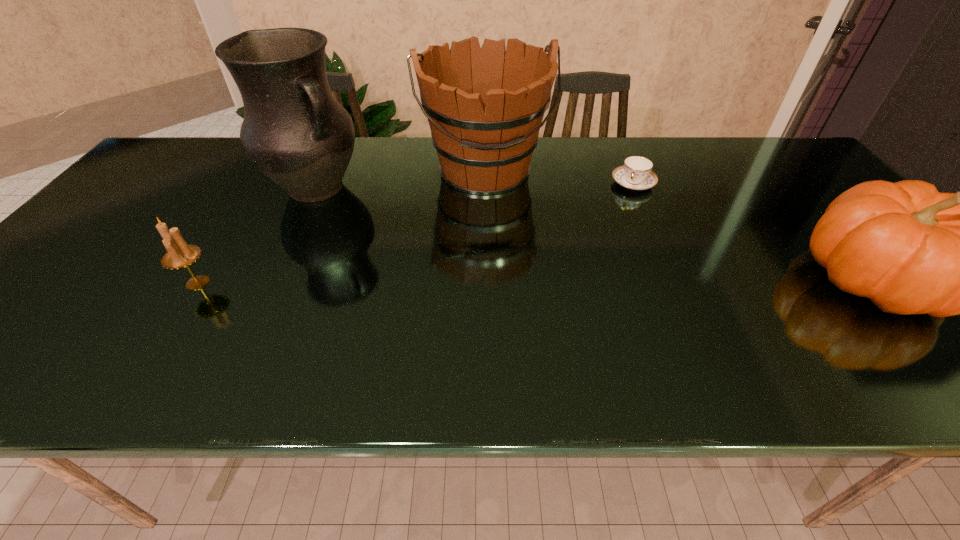
What are the coordinates of `vacant point located with the handle on the wine bucket` in the screenshot? It's located at (519, 274).

You are a GUI agent. You are given a task and a screenshot of the screen. Output one action in this format:
    pyautogui.click(x=<x>, y=<y>)
    Task: Click on the vacant space located with the handle on the wine bucket
    This screenshot has height=540, width=960.
    Given the screenshot: What is the action you would take?
    pyautogui.click(x=507, y=238)

I want to click on free location located 0.050m on the handle side of the pitcher, so click(x=354, y=215).

In order to click on vacant space located on the handle side of the pitcher in this screenshot , I will do click(x=403, y=251).

This screenshot has width=960, height=540. I want to click on vacant position located 0.360m on the handle side of the pitcher, so click(434, 273).

Image resolution: width=960 pixels, height=540 pixels. In order to click on teacup located at the far edge in this screenshot , I will do `click(635, 174)`.

Where is `wine bucket that is at the far edge`? wine bucket that is at the far edge is located at coordinates (485, 105).

The image size is (960, 540). In order to click on pitcher at the far edge in this screenshot , I will do `click(294, 130)`.

The height and width of the screenshot is (540, 960). Find the location of `vacant region at the far edge`. vacant region at the far edge is located at coordinates (606, 156).

Where is `vacant space at the near edge of the desktop`? vacant space at the near edge of the desktop is located at coordinates (420, 329).